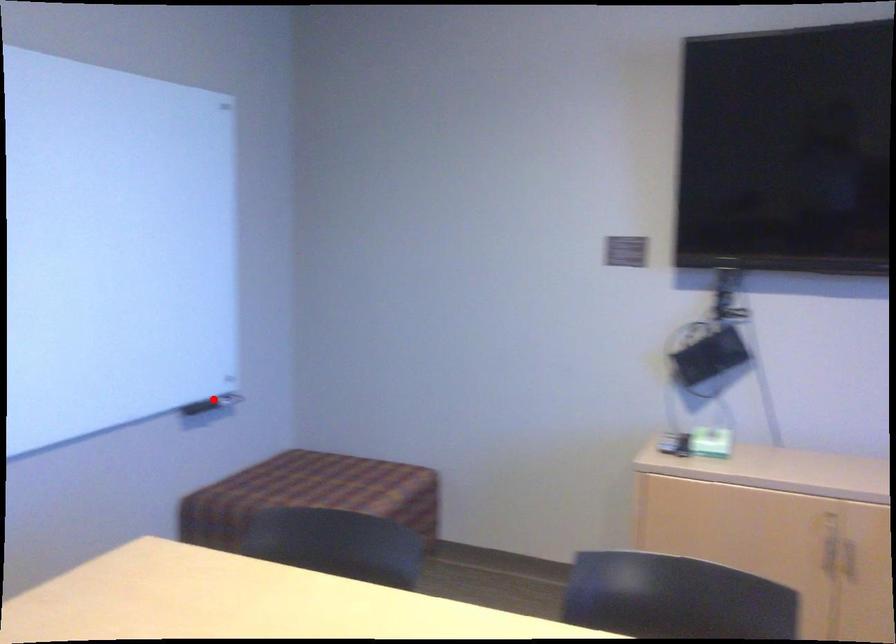
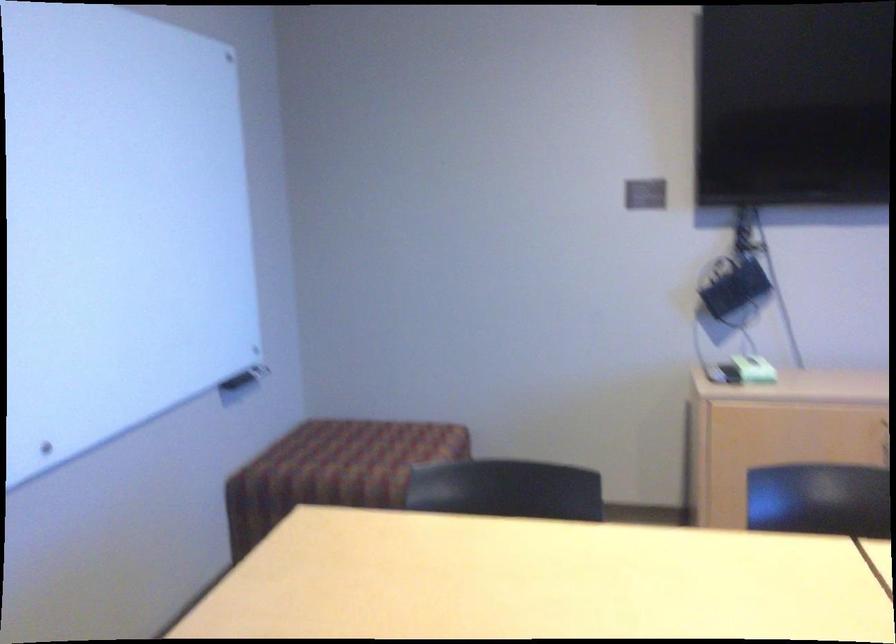
Where in the second image is the point corresponding to the highlighted location from the first image?

(246, 373)